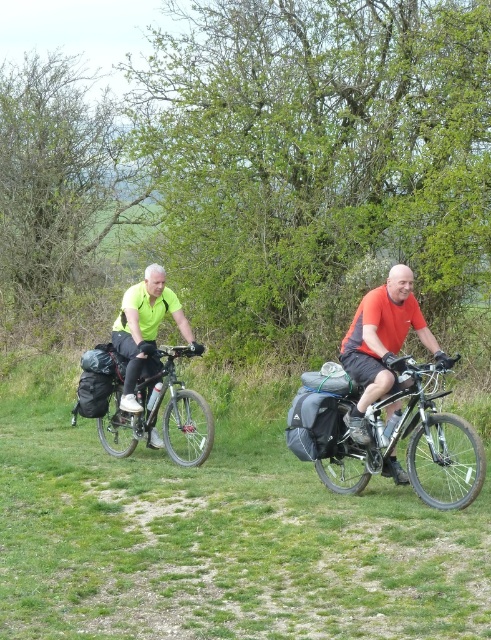
You are a cyclist approaching the scene. You see the green grass at center and the neon yellow jersey at center. Which object is closer to you as you approach the scene?

The green grass at center is closer to you because it is in front of the neon yellow jersey at center.